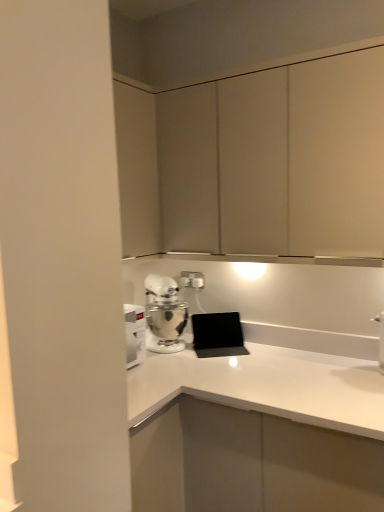
Question: In terms of width, does matte white cabinet at upper center look wider or thinner when compared to white metallic stand mixer at lower left?

Choices:
 (A) wide
 (B) thin

Answer: (A)

Question: In terms of size, does matte white cabinet at upper center appear bigger or smaller than white metallic stand mixer at lower left?

Choices:
 (A) small
 (B) big

Answer: (B)

Question: Which object is the closest to the white metallic stand mixer at lower left?

Choices:
 (A) matte white cabinet at upper center
 (B) white plastic electric outlet at center

Answer: (B)

Question: Which is nearer to the matte white cabinet at upper center?

Choices:
 (A) white plastic electric outlet at center
 (B) white metallic stand mixer at lower left

Answer: (B)